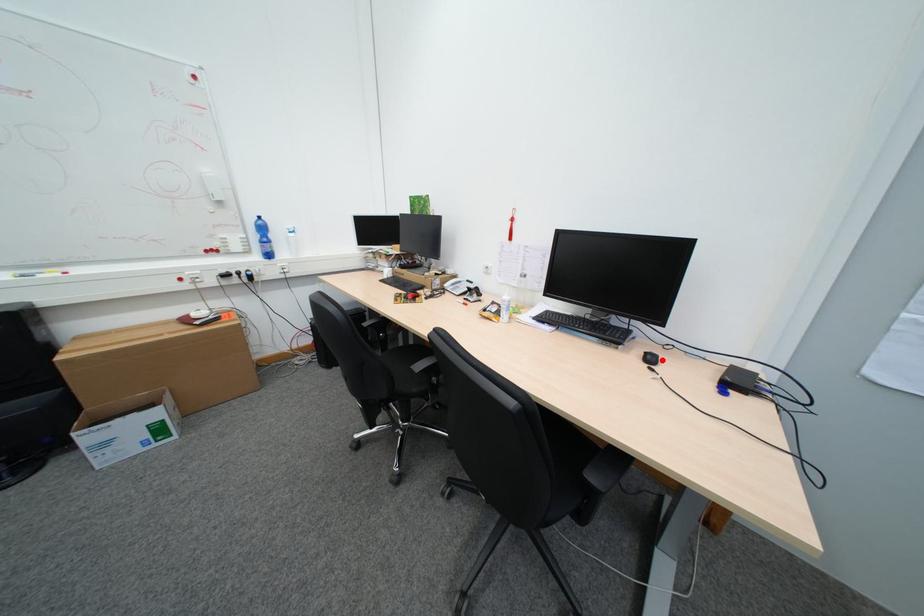
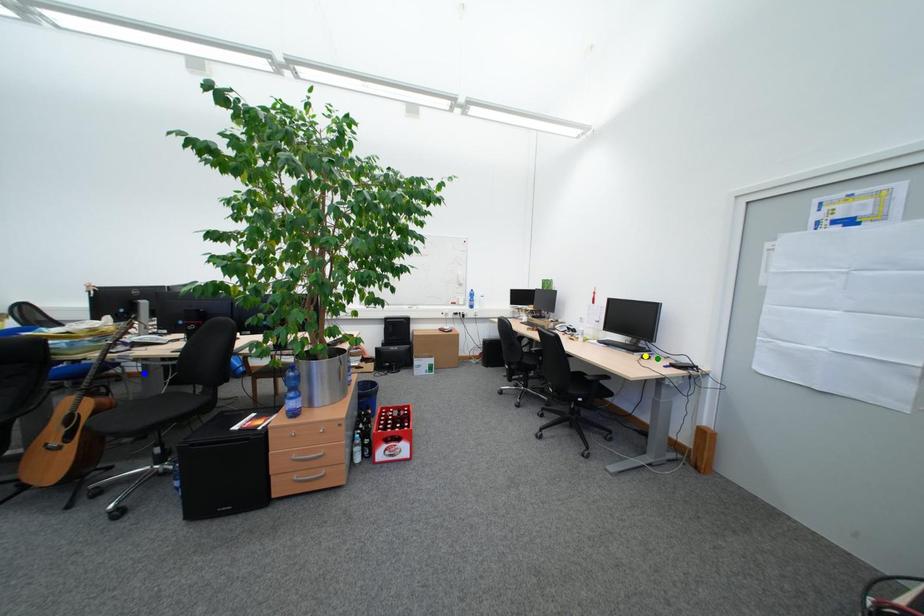
Question: I am providing you with two images of the same scene from different viewpoints. A red point is marked on the first image. You are given multiple points on the second image. Which spot in image 2 lines up with the point in image 1?

Choices:
 (A) blue point
 (B) green point
 (C) yellow point

Answer: (B)